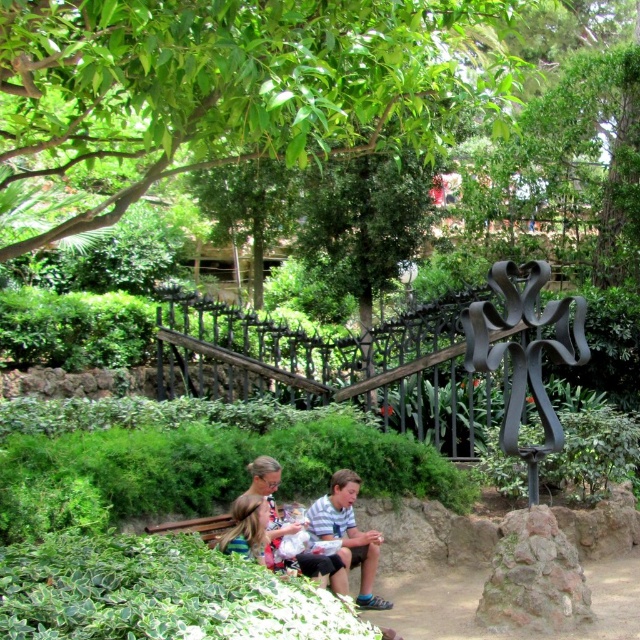
Can you confirm if green leafy tree at upper center is shorter than striped cotton shirt at center?

No, green leafy tree at upper center is not shorter than striped cotton shirt at center.

Is the position of green leafy tree at upper center less distant than that of striped cotton shirt at center?

Yes, green leafy tree at upper center is closer to the viewer.

Which is in front, point (269, 3) or point (339, 513)?

Point (269, 3) is more forward.

Where is `green leafy tree at upper center`? The width and height of the screenshot is (640, 640). green leafy tree at upper center is located at coordinates (234, 86).